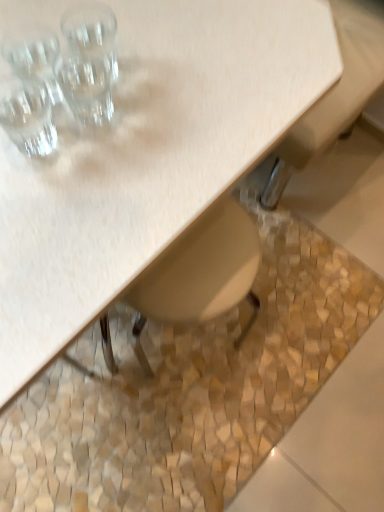
Where is `free spot above matte wood table at upper left (from a real-world perspective)`? The image size is (384, 512). free spot above matte wood table at upper left (from a real-world perspective) is located at coordinates (119, 91).